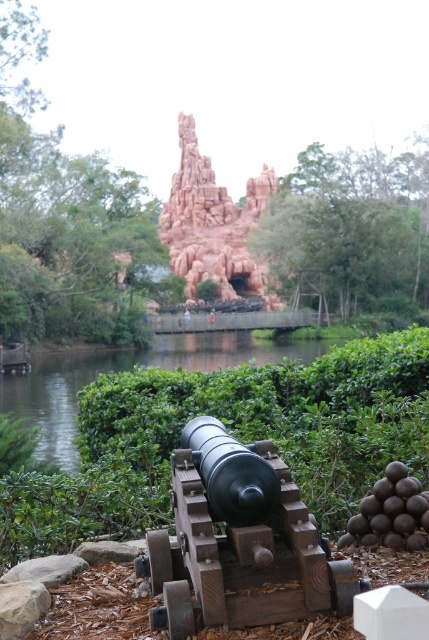
Question: Does wooden cannon at center have a smaller size compared to reddish-brown stone rock formation at center?

Choices:
 (A) no
 (B) yes

Answer: (B)

Question: Does green leafy bush at center appear on the right side of reddish-brown stone rock formation at center?

Choices:
 (A) no
 (B) yes

Answer: (B)

Question: Among these objects, which one is farthest from the camera?

Choices:
 (A) reddish-brown stone rock formation at center
 (B) wooden cannon at center
 (C) green leafy bush at center

Answer: (A)

Question: Among these points, which one is farthest from the camera?

Choices:
 (A) (193, 236)
 (B) (235, 468)

Answer: (A)

Question: Among these objects, which one is nearest to the camera?

Choices:
 (A) wooden cannon at center
 (B) reddish-brown stone rock formation at center

Answer: (A)

Question: Is green leafy bush at center to the left of reddish-brown stone rock formation at center from the viewer's perspective?

Choices:
 (A) no
 (B) yes

Answer: (A)